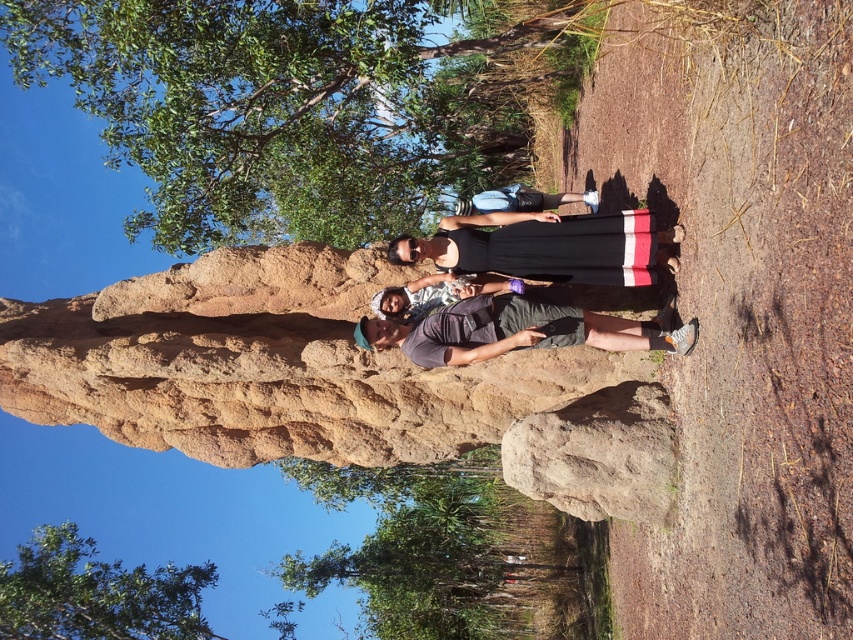
Question: Among these objects, which one is farthest from the camera?

Choices:
 (A) black dress at center
 (B) green leafy tree at lower center

Answer: (B)

Question: Among these objects, which one is nearest to the camera?

Choices:
 (A) brown rough rock at lower center
 (B) green leafy tree at lower center

Answer: (A)

Question: Considering the relative positions of brown rough rock at lower center and black dress at center in the image provided, where is brown rough rock at lower center located with respect to black dress at center?

Choices:
 (A) below
 (B) above

Answer: (A)

Question: Which object appears closest to the camera in this image?

Choices:
 (A) green leafy tree at lower center
 (B) brown rough rock at lower center

Answer: (B)

Question: Does green leafy tree at lower center come behind brown rough rock at lower center?

Choices:
 (A) yes
 (B) no

Answer: (A)

Question: Is brown rough rock at lower center bigger than green leafy tree at lower left?

Choices:
 (A) yes
 (B) no

Answer: (B)